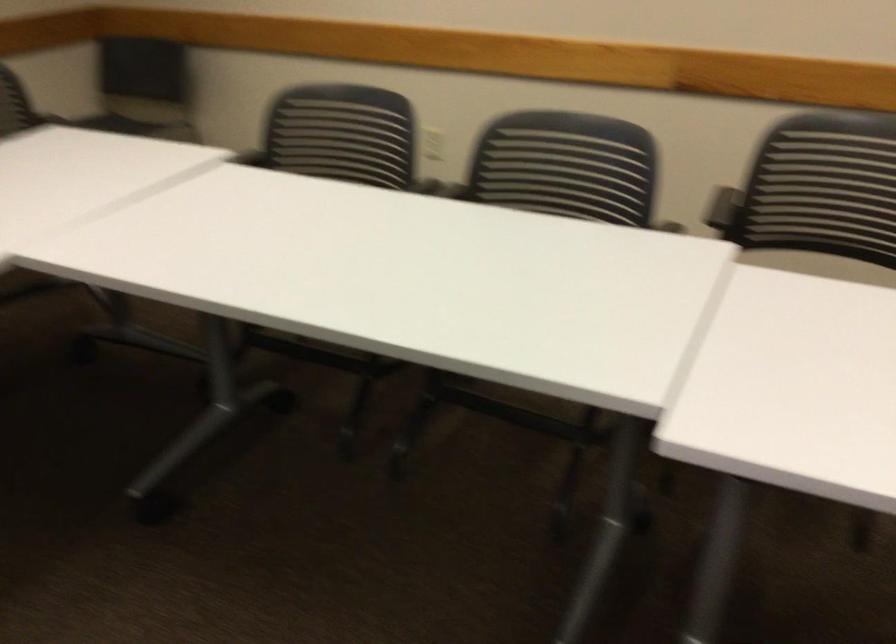
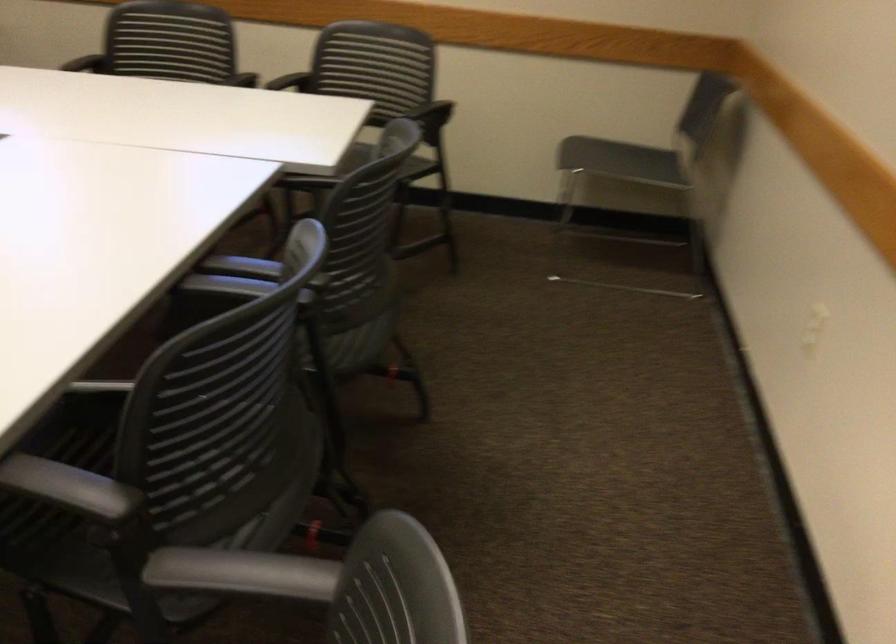
In the second image, find the point that corresponds to [609,234] in the first image.

(209, 458)